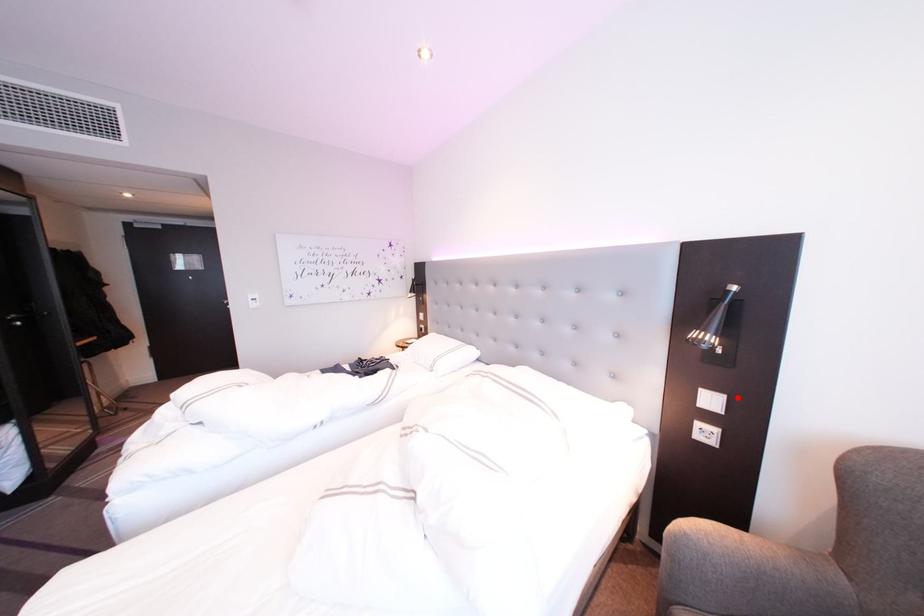
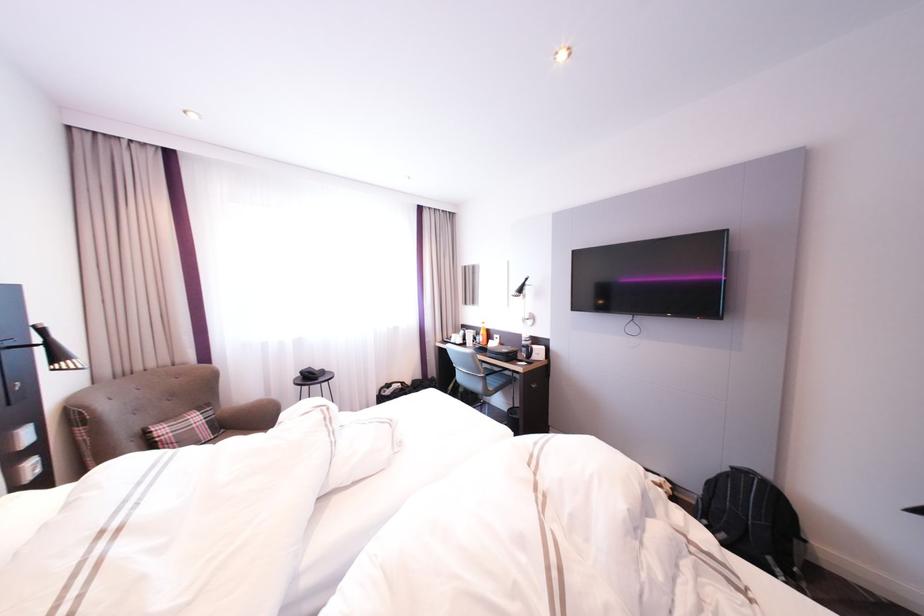
Question: I am providing you with two images of the same scene from different viewpoints. Given a red point in image1, look at the same physical point in image2. Is it:

Choices:
 (A) Closer to the viewpoint
 (B) Farther from the viewpoint

Answer: (B)